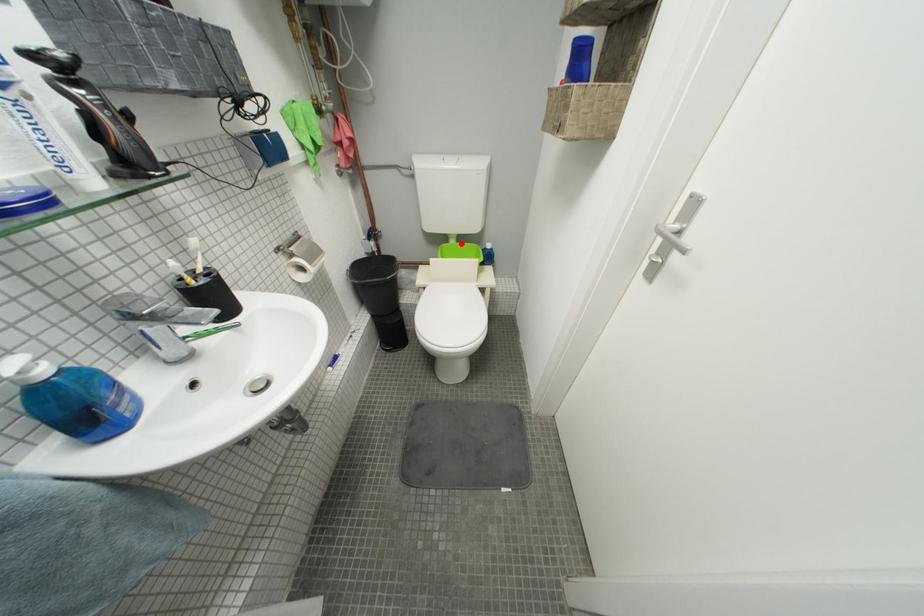
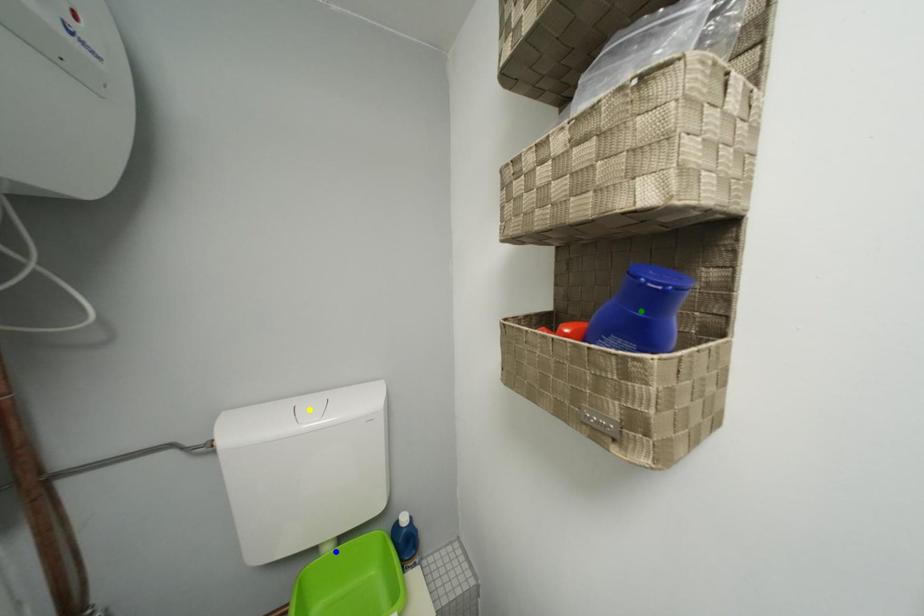
Question: I am providing you with two images of the same scene from different viewpoints. A red point is marked on the first image. You are given multiple points on the second image. Can you choose the point in image 2 that corresponds to the point in image 1?

Choices:
 (A) green point
 (B) blue point
 (C) yellow point

Answer: (B)